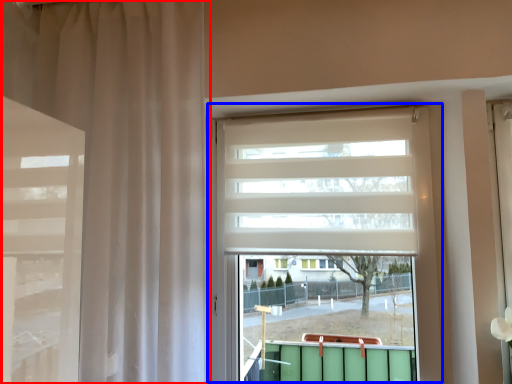
Question: Which object appears farthest to the camera in this image, curtain (highlighted by a red box) or window (highlighted by a blue box)?

Choices:
 (A) curtain
 (B) window

Answer: (B)